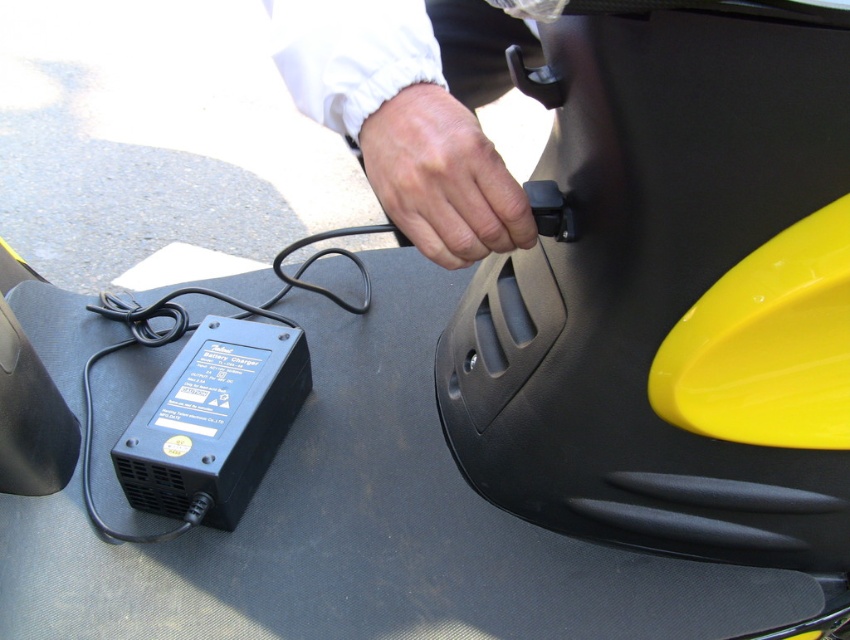
Can you confirm if white fabric hand at upper center is thinner than black plastic plug at lower left?

No.

Consider the image. Can you confirm if white fabric hand at upper center is positioned below black plastic plug at lower left?

Incorrect, white fabric hand at upper center is not positioned below black plastic plug at lower left.

Between point (454, 81) and point (134, 496), which one is positioned behind?

Point (454, 81)

The height and width of the screenshot is (640, 850). I want to click on white fabric hand at upper center, so click(412, 109).

Does black plastic plug at lower left lie behind skinny white hand at center?

Yes, black plastic plug at lower left is further from the viewer.

Who is more forward, (x=173, y=384) or (x=472, y=260)?

Point (x=472, y=260) is more forward.

Does point (208, 316) come farther from viewer compared to point (466, 154)?

Yes, point (208, 316) is farther from viewer.

Where is `black plastic plug at lower left`? Image resolution: width=850 pixels, height=640 pixels. black plastic plug at lower left is located at coordinates (214, 420).

Is white fabric hand at upper center wider than skinny white hand at center?

Yes.

Does point (508, 182) come farther from viewer compared to point (480, 214)?

Yes, point (508, 182) is farther from viewer.

Locate an element on the screen. white fabric hand at upper center is located at coordinates (412, 109).